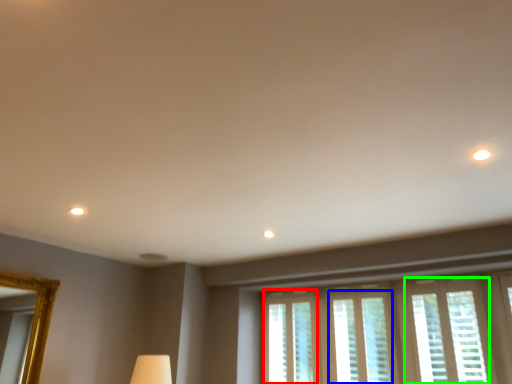
Question: Which is nearer to the window (highlighted by a red box)? window (highlighted by a blue box) or window (highlighted by a green box).

Choices:
 (A) window
 (B) window

Answer: (A)